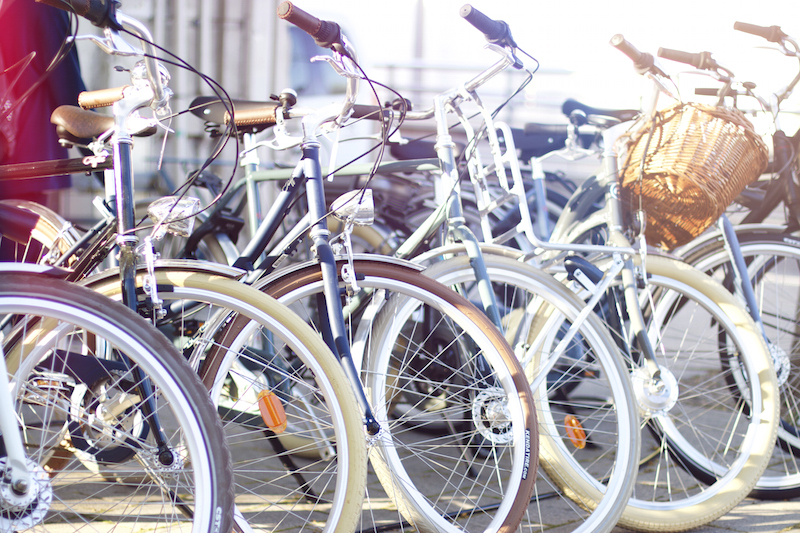
The height and width of the screenshot is (533, 800). What are the coordinates of `seats` in the screenshot? It's located at (94, 124), (236, 108), (418, 151), (548, 131), (602, 106).